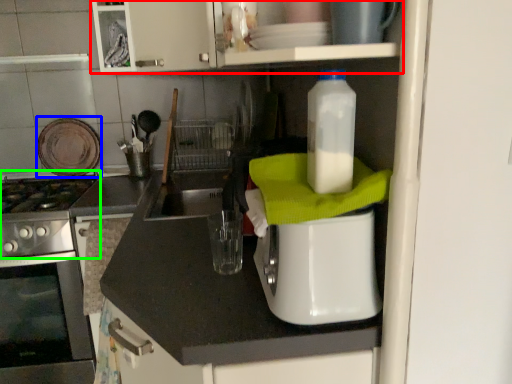
Question: Considering the real-world distances, which object is farthest from cabinetry (highlighted by a red box)? appliance (highlighted by a blue box) or gas stove (highlighted by a green box)?

Choices:
 (A) appliance
 (B) gas stove

Answer: (B)